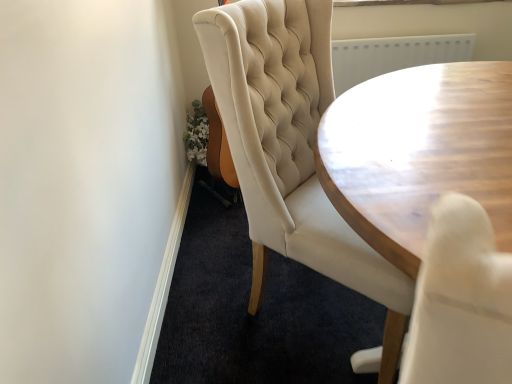
Question: Is tufted cream chair at center a part of wooden table at center?

Choices:
 (A) no
 (B) yes

Answer: (A)

Question: Is wooden table at center bigger than tufted cream chair at center?

Choices:
 (A) yes
 (B) no

Answer: (B)

Question: From the image's perspective, is wooden table at center below tufted cream chair at center?

Choices:
 (A) no
 (B) yes

Answer: (B)

Question: From a real-world perspective, does wooden table at center sit lower than tufted cream chair at center?

Choices:
 (A) no
 (B) yes

Answer: (A)

Question: Can you confirm if wooden table at center is thinner than tufted cream chair at center?

Choices:
 (A) no
 (B) yes

Answer: (A)

Question: Is wooden table at center positioned beyond the bounds of tufted cream chair at center?

Choices:
 (A) no
 (B) yes

Answer: (B)

Question: Does tufted cream chair at center contain wooden table at center?

Choices:
 (A) no
 (B) yes

Answer: (A)

Question: Is tufted cream chair at center bigger than wooden table at center?

Choices:
 (A) no
 (B) yes

Answer: (B)

Question: Is tufted cream chair at center located outside wooden table at center?

Choices:
 (A) yes
 (B) no

Answer: (A)

Question: Can you confirm if tufted cream chair at center is shorter than wooden table at center?

Choices:
 (A) no
 (B) yes

Answer: (B)

Question: Is tufted cream chair at center positioned behind wooden table at center?

Choices:
 (A) no
 (B) yes

Answer: (B)

Question: Is tufted cream chair at center at the right side of wooden table at center?

Choices:
 (A) no
 (B) yes

Answer: (A)

Question: From a real-world perspective, is tufted cream chair at center positioned above or below wooden table at center?

Choices:
 (A) above
 (B) below

Answer: (B)